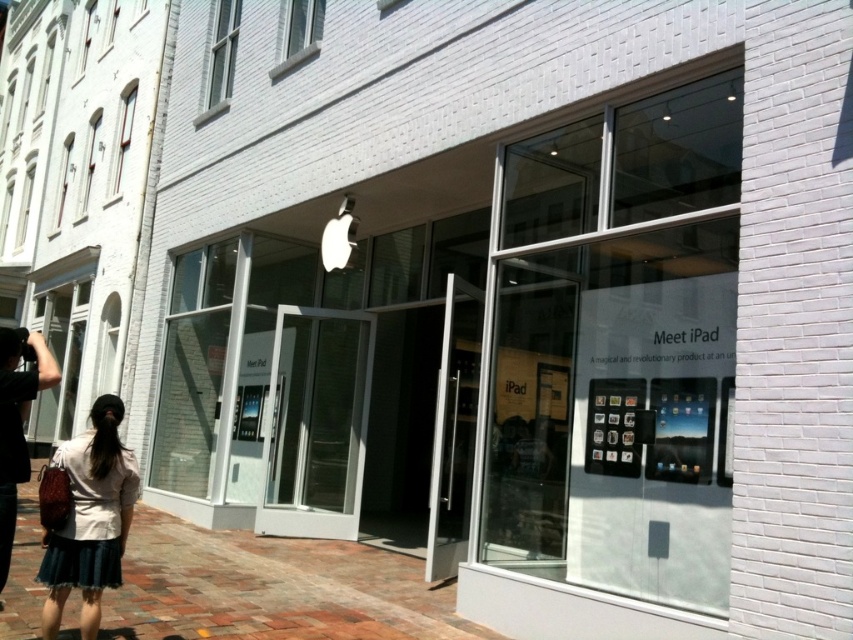
Question: Does denim skirt at lower left come in front of black fabric bag at lower left?

Choices:
 (A) yes
 (B) no

Answer: (B)

Question: Is brick pavement at lower left further to camera compared to denim skirt at lower left?

Choices:
 (A) yes
 (B) no

Answer: (A)

Question: Which object is closer to the camera taking this photo?

Choices:
 (A) denim skirt at lower left
 (B) brick pavement at lower left

Answer: (A)

Question: Among these objects, which one is nearest to the camera?

Choices:
 (A) black fabric bag at lower left
 (B) brick pavement at lower left

Answer: (A)

Question: Considering the relative positions of denim skirt at lower left and black fabric bag at lower left in the image provided, where is denim skirt at lower left located with respect to black fabric bag at lower left?

Choices:
 (A) above
 (B) below

Answer: (B)

Question: Considering the real-world distances, which object is closest to the brick pavement at lower left?

Choices:
 (A) black fabric bag at lower left
 (B) denim skirt at lower left

Answer: (B)